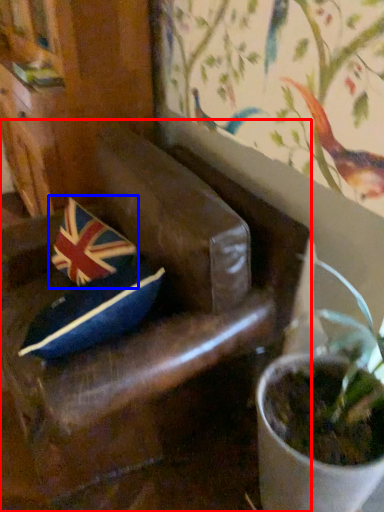
Question: Which object appears farthest to the camera in this image, chair (highlighted by a red box) or flag (highlighted by a blue box)?

Choices:
 (A) chair
 (B) flag

Answer: (B)